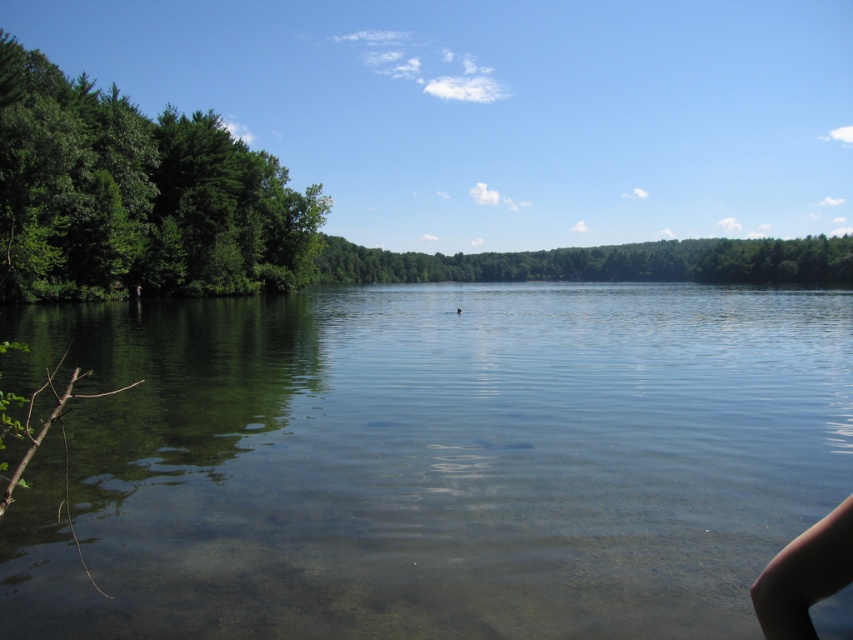
You are standing on the lakeside and want to cross to the other side. You see the clear water at center and the skinny tan leg at lower right. Which path should you take to avoid the narrower area?

You should take the path through the clear water at center because its width surpasses the skinny tan leg at lower right, making it wider and safer for crossing.

You are standing at the lakeside and want to take a photo that includes both the green leafy trees at left and the green leafy trees at center. Which trees will appear closer to you in the photo?

The green leafy trees at left will appear closer to you in the photo because they are positioned in front of the green leafy trees at center.

You are a photographer standing at the lakeside. You want to capture a photo of the clear water at center and the skinny tan leg at lower right in the same frame. Based on their positions, which object should you adjust your camera to focus on first to ensure both are in the shot?

The clear water at center is positioned on the right side of the skinny tan leg at lower right. To ensure both are in the shot, focus on the skinny tan leg at lower right first since it is closer to the photographer and adjust the camera angle to include the clear water at center on its right side.